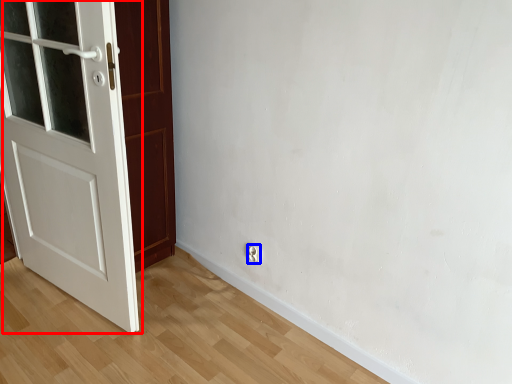
Question: Among these objects, which one is nearest to the camera, door (highlighted by a red box) or electric outlet (highlighted by a blue box)?

Choices:
 (A) door
 (B) electric outlet

Answer: (A)